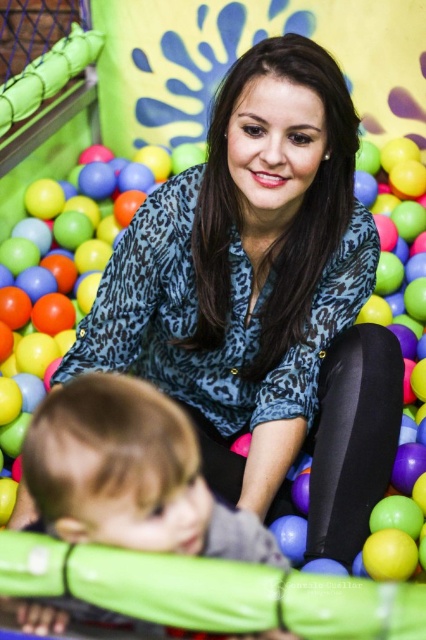
You are a parent trying to locate your child in a busy ball pit. You see the blonde hair toddler at center and the matte plastic ball at center. Which object is closer to you?

The blonde hair toddler at center is closer to you since it is in front of the matte plastic ball at center.

From the picture: You are a parent trying to locate your child in the ball pit. You see the blonde hair toddler at center and the matte plastic ball at center. Which object is positioned to the right of the other?

The blonde hair toddler at center is to the right of the matte plastic ball at center.